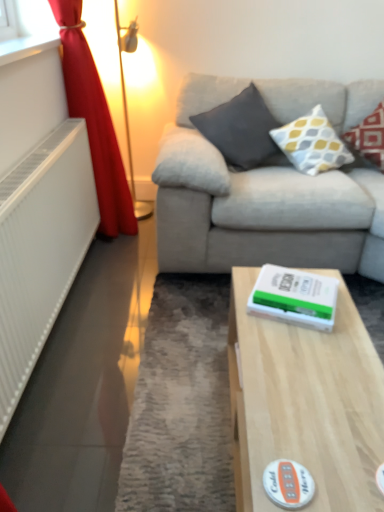
Question: From the image's perspective, is metallic gold table lamp at left positioned above or below dark gray fabric pillow at upper center, the first pillow when ordered from left to right?

Choices:
 (A) below
 (B) above

Answer: (B)

Question: Looking at their shapes, would you say metallic gold table lamp at left is wider or thinner than dark gray fabric pillow at upper center, the first pillow when ordered from left to right?

Choices:
 (A) wide
 (B) thin

Answer: (B)

Question: Which object is the closest to the metallic gold table lamp at left?

Choices:
 (A) white matte sticker at lower center
 (B) dark gray fabric pillow at upper center, the first pillow when ordered from left to right
 (C) light wood table at center
 (D) patterned fabric pillow at upper right, the 1th pillow from the right
 (E) red velvet curtain at left

Answer: (E)

Question: Which of these objects is positioned farthest from the white plastic radiator at left?

Choices:
 (A) white matte paperback book at center
 (B) white textured pillow at upper right, the second pillow viewed from the right
 (C) metallic gold table lamp at left
 (D) red velvet curtain at left
 (E) patterned fabric pillow at upper right, acting as the third pillow starting from the left

Answer: (E)